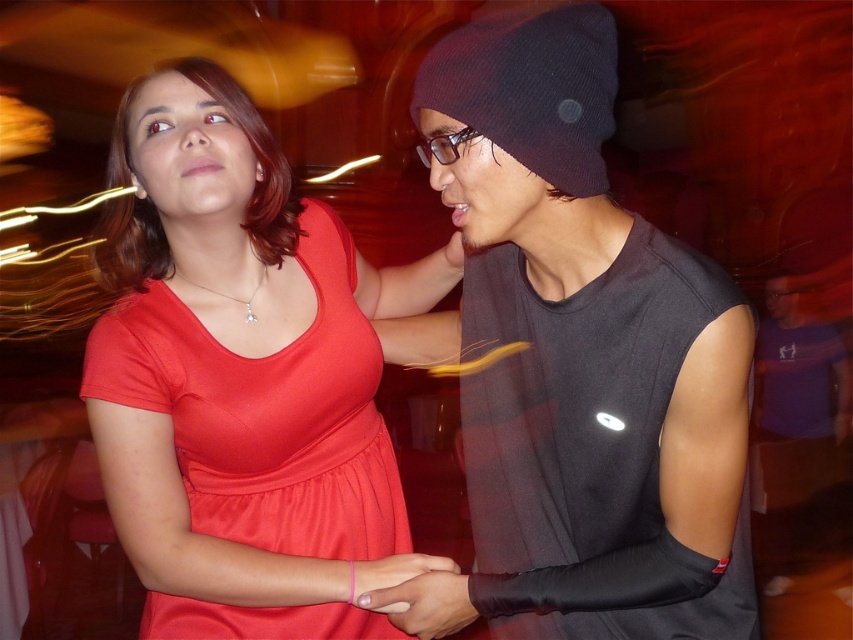
You are standing in the room and want to take a photo of the satin red dress at center. The camera you have can only focus on objects located between the coordinates of 0.5 and 0.7 on the x and y axes. Will the dress be in focus?

The satin red dress at center is located at point [267,412], which falls within the x and y range of 0.5 to 0.7. Therefore, the dress will be in focus.

You are at a party and want to hand a drink to the black matte shirt at right. To avoid hitting the black knit beanie at upper center, should you move the drink to the left or right?

The black knit beanie at upper center is in front of the black matte shirt at right, so you should move the drink to the right to avoid hitting it.

You are standing in the same room as the two people in the image. You want to walk towards the two points marked in the image. Which point, point [479,515] or point [374,572], will you reach first?

You will reach point [479,515] first because it is closer to you than point [374,572], which is further away.